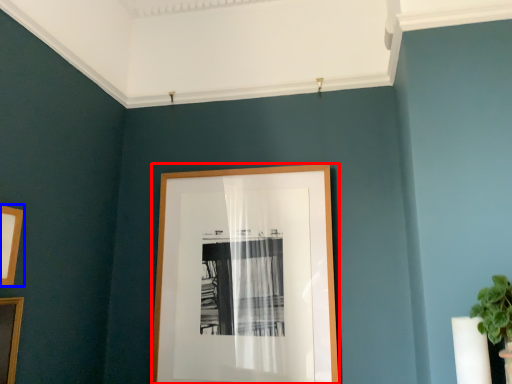
Question: Which object is closer to the camera taking this photo, picture frame (highlighted by a red box) or picture frame (highlighted by a blue box)?

Choices:
 (A) picture frame
 (B) picture frame

Answer: (B)